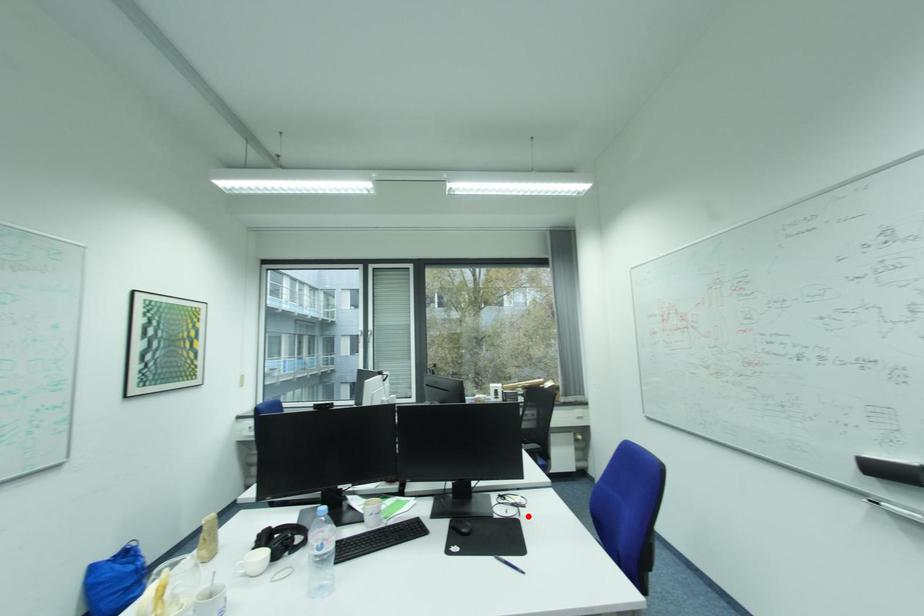
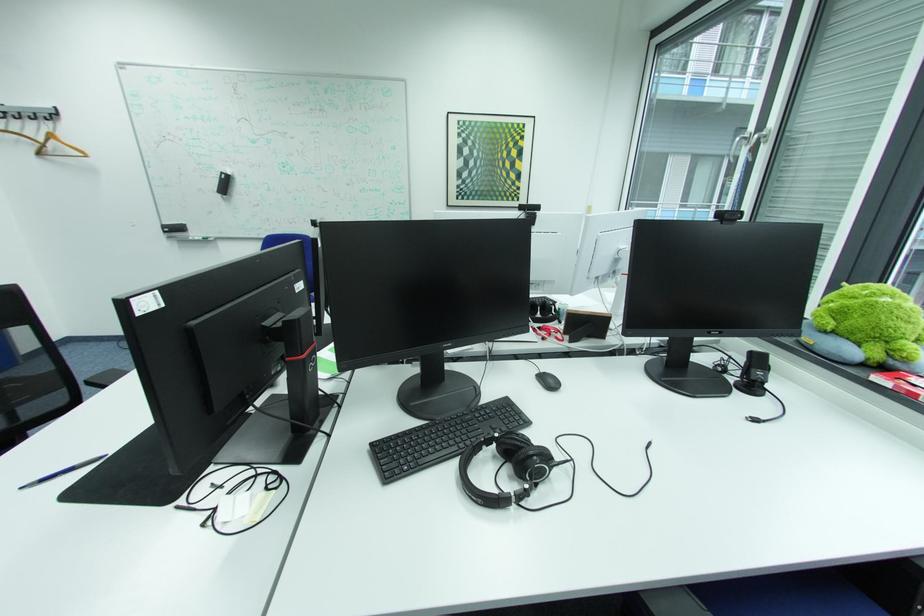
Question: I am providing you with two images of the same scene from different viewpoints. A red point is shown in image1. For the corresponding object point in image2, is it positioned nearer or farther from the camera?

Choices:
 (A) Nearer
 (B) Farther

Answer: (B)